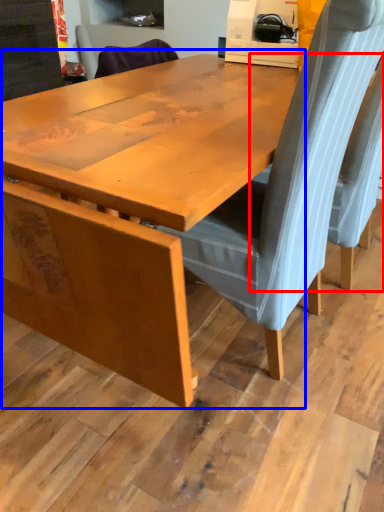
Question: Which point is further to the camera, chair (highlighted by a red box) or table (highlighted by a blue box)?

Choices:
 (A) chair
 (B) table

Answer: (A)